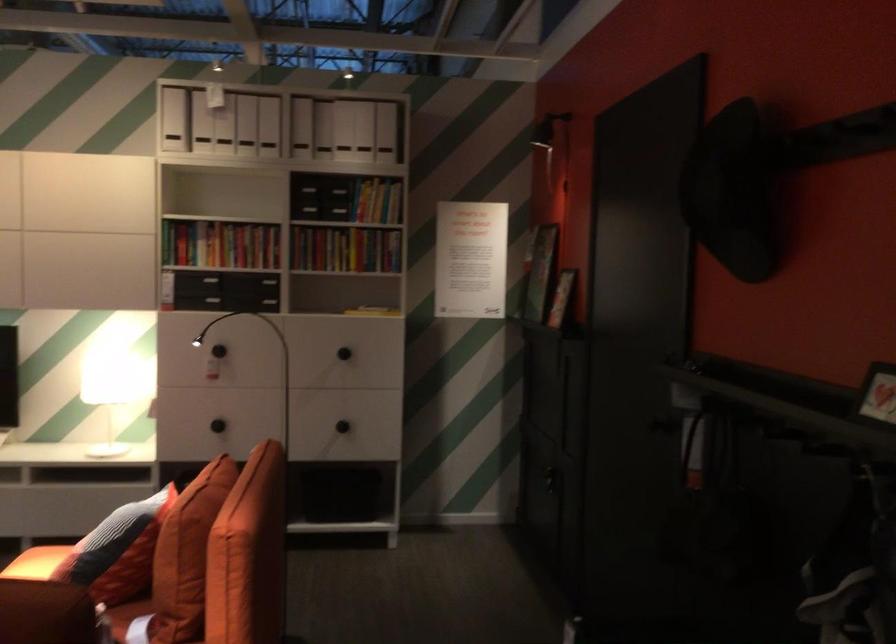
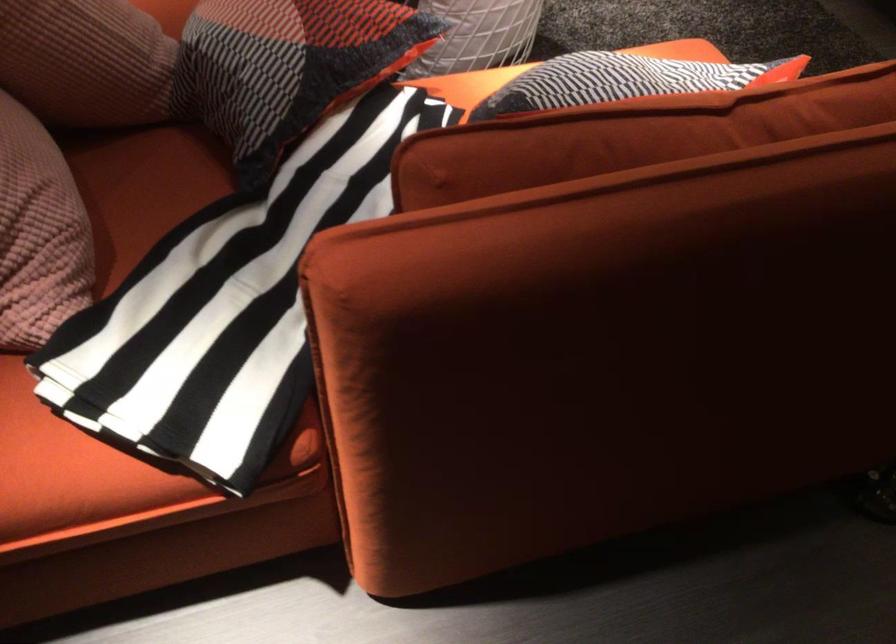
Locate, in the second image, the point that corresponds to point (151, 507) in the first image.

(623, 80)